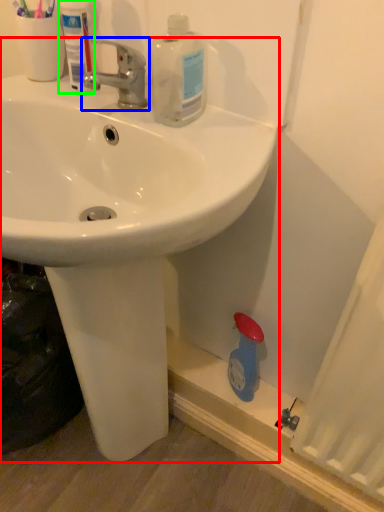
Question: Which is nearer to the sink (highlighted by a red box)? tap (highlighted by a blue box) or mouthwash (highlighted by a green box).

Choices:
 (A) tap
 (B) mouthwash

Answer: (A)